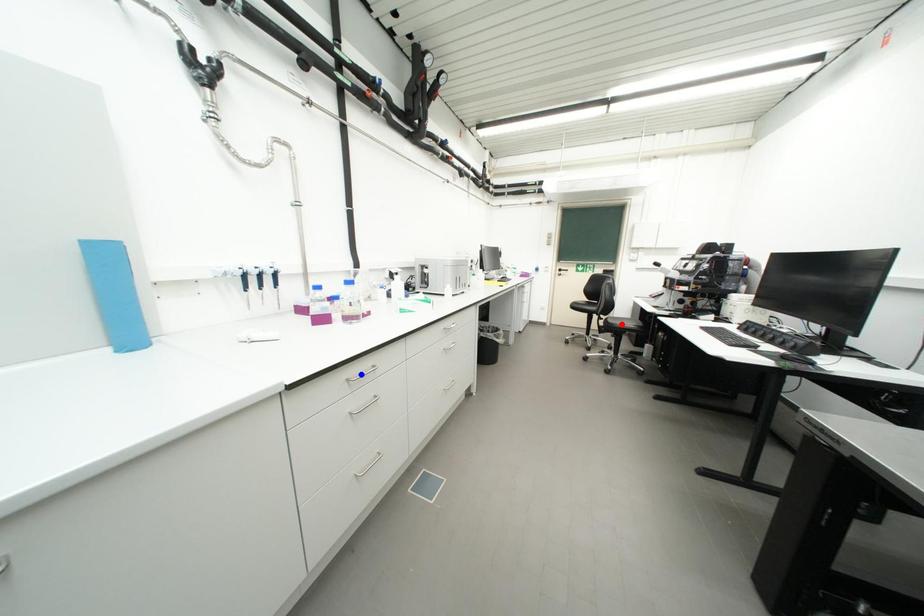
Question: Two points are marked on the image. Which point is closer to the camera?

Choices:
 (A) Blue point is closer.
 (B) Red point is closer.

Answer: (A)